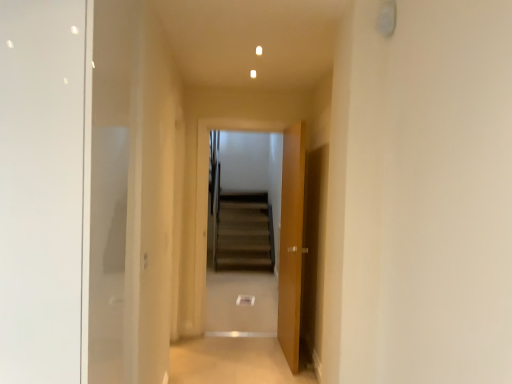
Question: Is beige carpet at center positioned far away from brown carpeted stairs at center?

Choices:
 (A) yes
 (B) no

Answer: (A)

Question: Is beige carpet at center positioned in front of brown carpeted stairs at center?

Choices:
 (A) no
 (B) yes

Answer: (B)

Question: Is beige carpet at center positioned behind brown carpeted stairs at center?

Choices:
 (A) yes
 (B) no

Answer: (B)

Question: From a real-world perspective, is beige carpet at center positioned under brown carpeted stairs at center based on gravity?

Choices:
 (A) no
 (B) yes

Answer: (B)

Question: From the image's perspective, is beige carpet at center located beneath brown carpeted stairs at center?

Choices:
 (A) yes
 (B) no

Answer: (A)

Question: Is point (290, 145) closer or farther from the camera than point (232, 216)?

Choices:
 (A) closer
 (B) farther

Answer: (A)

Question: Based on their sizes in the image, would you say wooden door at center is bigger or smaller than brown carpeted stairs at center?

Choices:
 (A) big
 (B) small

Answer: (A)

Question: Would you say wooden door at center is to the left or to the right of brown carpeted stairs at center in the picture?

Choices:
 (A) right
 (B) left

Answer: (A)

Question: From their relative heights in the image, would you say wooden door at center is taller or shorter than brown carpeted stairs at center?

Choices:
 (A) short
 (B) tall

Answer: (A)

Question: Is brown carpeted stairs at center inside the boundaries of beige carpet at center, or outside?

Choices:
 (A) inside
 (B) outside

Answer: (B)

Question: Considering the relative positions of brown carpeted stairs at center and beige carpet at center in the image provided, is brown carpeted stairs at center to the left or to the right of beige carpet at center?

Choices:
 (A) left
 (B) right

Answer: (B)

Question: From the image's perspective, is brown carpeted stairs at center located above or below beige carpet at center?

Choices:
 (A) below
 (B) above

Answer: (B)

Question: From a real-world perspective, is brown carpeted stairs at center positioned above or below beige carpet at center?

Choices:
 (A) above
 (B) below

Answer: (A)

Question: Is beige carpet at center spatially inside brown carpeted stairs at center, or outside of it?

Choices:
 (A) outside
 (B) inside

Answer: (A)

Question: Considering the positions of beige carpet at center and brown carpeted stairs at center in the image, is beige carpet at center taller or shorter than brown carpeted stairs at center?

Choices:
 (A) short
 (B) tall

Answer: (A)